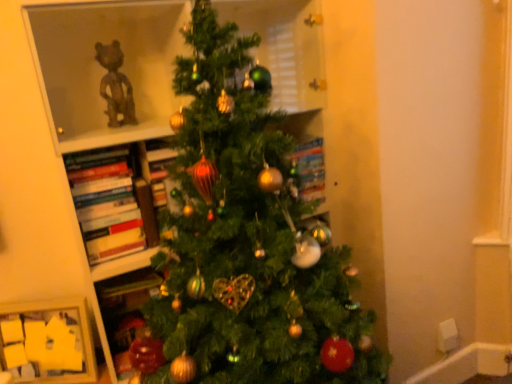
Question: Is green matte christmas tree at center located outside hardcover books at left?

Choices:
 (A) yes
 (B) no

Answer: (A)

Question: Can you confirm if green matte christmas tree at center is bigger than hardcover books at left?

Choices:
 (A) yes
 (B) no

Answer: (A)

Question: Does green matte christmas tree at center turn towards hardcover books at left?

Choices:
 (A) yes
 (B) no

Answer: (A)

Question: From a real-world perspective, is green matte christmas tree at center over hardcover books at left?

Choices:
 (A) yes
 (B) no

Answer: (B)

Question: Can you confirm if green matte christmas tree at center is shorter than hardcover books at left?

Choices:
 (A) yes
 (B) no

Answer: (B)

Question: In terms of size, does green matte christmas tree at center appear bigger or smaller than wooden picture frame at lower left?

Choices:
 (A) small
 (B) big

Answer: (B)

Question: From their relative heights in the image, would you say green matte christmas tree at center is taller or shorter than wooden picture frame at lower left?

Choices:
 (A) tall
 (B) short

Answer: (A)

Question: From the image's perspective, is green matte christmas tree at center above or below wooden picture frame at lower left?

Choices:
 (A) above
 (B) below

Answer: (A)

Question: Does point click(x=176, y=215) appear closer or farther from the camera than point click(x=93, y=357)?

Choices:
 (A) closer
 (B) farther

Answer: (A)

Question: From the image's perspective, relative to wooden picture frame at lower left, is hardcover books at left above or below?

Choices:
 (A) below
 (B) above

Answer: (B)

Question: From a real-world perspective, is hardcover books at left positioned above or below wooden picture frame at lower left?

Choices:
 (A) above
 (B) below

Answer: (A)

Question: Considering the positions of point (96, 177) and point (53, 301), is point (96, 177) closer or farther from the camera than point (53, 301)?

Choices:
 (A) farther
 (B) closer

Answer: (B)

Question: Considering the positions of hardcover books at left and wooden picture frame at lower left in the image, is hardcover books at left wider or thinner than wooden picture frame at lower left?

Choices:
 (A) wide
 (B) thin

Answer: (A)

Question: Considering the positions of point (37, 337) and point (109, 238), is point (37, 337) closer or farther from the camera than point (109, 238)?

Choices:
 (A) farther
 (B) closer

Answer: (A)

Question: From the image's perspective, is wooden picture frame at lower left above or below hardcover books at left?

Choices:
 (A) below
 (B) above

Answer: (A)